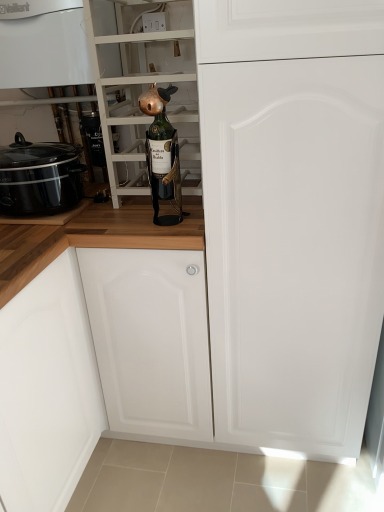
Locate an element on the screen. The height and width of the screenshot is (512, 384). free space between green glass bottle at center and green glass bottle at center is located at coordinates (150, 216).